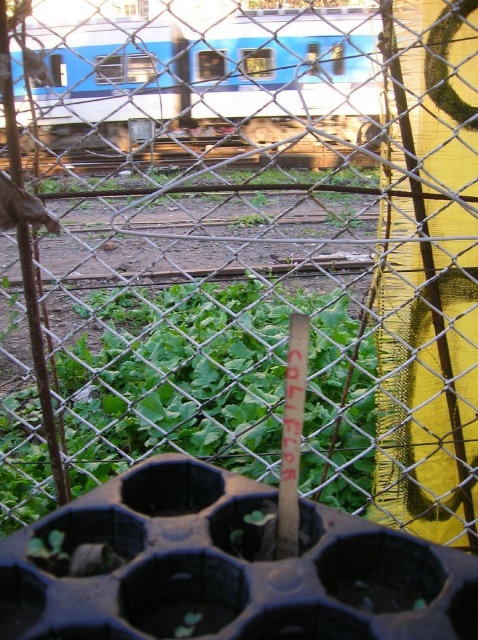
Is green leafy plant at center bigger than blue painted metal train at upper center?

No, green leafy plant at center is not bigger than blue painted metal train at upper center.

From the picture: Does green leafy plant at center have a greater height compared to blue painted metal train at upper center?

Incorrect, green leafy plant at center's height is not larger of blue painted metal train at upper center's.

Between point (343, 346) and point (316, 13), which one is positioned behind?

Point (343, 346)

Where is `green leafy plant at center`? green leafy plant at center is located at coordinates (218, 387).